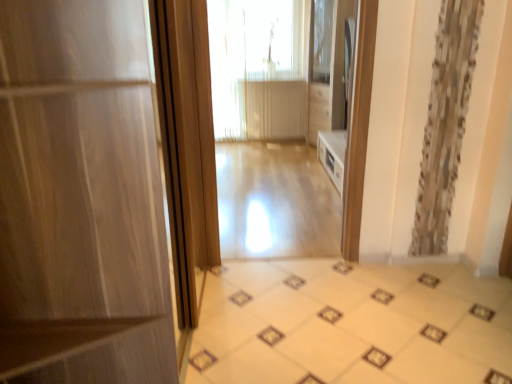
Question: From the image's perspective, does beige glossy tile at center appear higher than translucent fabric at center?

Choices:
 (A) yes
 (B) no

Answer: (B)

Question: Does beige glossy tile at center have a greater height compared to translucent fabric at center?

Choices:
 (A) yes
 (B) no

Answer: (B)

Question: Does beige glossy tile at center appear on the right side of translucent fabric at center?

Choices:
 (A) yes
 (B) no

Answer: (A)

Question: Considering the relative sizes of beige glossy tile at center and translucent fabric at center in the image provided, is beige glossy tile at center smaller than translucent fabric at center?

Choices:
 (A) yes
 (B) no

Answer: (A)

Question: Is beige glossy tile at center oriented towards translucent fabric at center?

Choices:
 (A) no
 (B) yes

Answer: (A)

Question: Can you confirm if beige glossy tile at center is wider than translucent fabric at center?

Choices:
 (A) no
 (B) yes

Answer: (B)

Question: Is light wood floor at center looking in the opposite direction of beige glossy tile at center?

Choices:
 (A) no
 (B) yes

Answer: (A)

Question: Are light wood floor at center and beige glossy tile at center located far from each other?

Choices:
 (A) no
 (B) yes

Answer: (B)

Question: Considering the relative sizes of light wood floor at center and beige glossy tile at center in the image provided, is light wood floor at center smaller than beige glossy tile at center?

Choices:
 (A) yes
 (B) no

Answer: (A)

Question: Is light wood floor at center to the right of beige glossy tile at center from the viewer's perspective?

Choices:
 (A) yes
 (B) no

Answer: (B)

Question: Considering the relative sizes of light wood floor at center and beige glossy tile at center in the image provided, is light wood floor at center taller than beige glossy tile at center?

Choices:
 (A) no
 (B) yes

Answer: (B)

Question: Would you say light wood floor at center is outside beige glossy tile at center?

Choices:
 (A) yes
 (B) no

Answer: (A)

Question: Considering the relative sizes of light wood floor at center and light wood floor at center in the image provided, is light wood floor at center thinner than light wood floor at center?

Choices:
 (A) no
 (B) yes

Answer: (A)